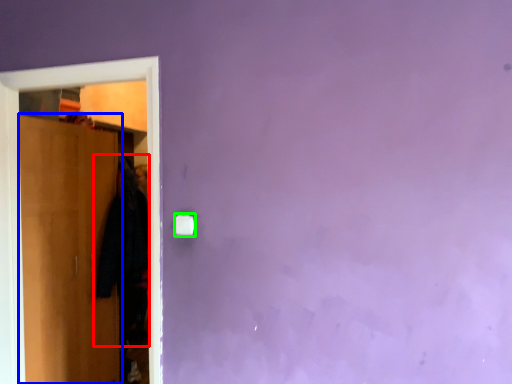
Question: Estimate the real-world distances between objects in this image. Which object is closer to clothing (highlighted by a red box), door (highlighted by a blue box) or light switch (highlighted by a green box)?

Choices:
 (A) door
 (B) light switch

Answer: (A)